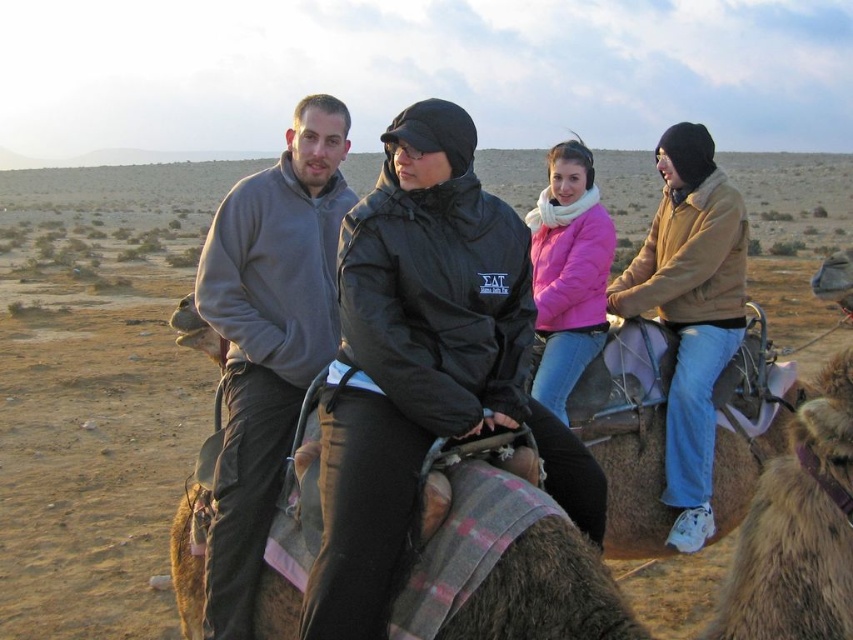
Question: Based on their relative distances, which object is farther from the black matte jacket at center?

Choices:
 (A) gray fleece jacket at center
 (B) pink matte jacket at center

Answer: (B)

Question: Which point appears farthest from the camera in this image?

Choices:
 (A) (560, 269)
 (B) (548, 451)

Answer: (A)

Question: Is black matte jacket at center wider than pink matte jacket at center?

Choices:
 (A) no
 (B) yes

Answer: (B)

Question: Which point is closer to the camera taking this photo?

Choices:
 (A) (x=532, y=224)
 (B) (x=430, y=212)
 (C) (x=291, y=125)

Answer: (B)

Question: Does gray fleece jacket at center appear on the right side of pink matte jacket at center?

Choices:
 (A) no
 (B) yes

Answer: (A)

Question: Does black matte jacket at center appear over pink matte jacket at center?

Choices:
 (A) yes
 (B) no

Answer: (B)